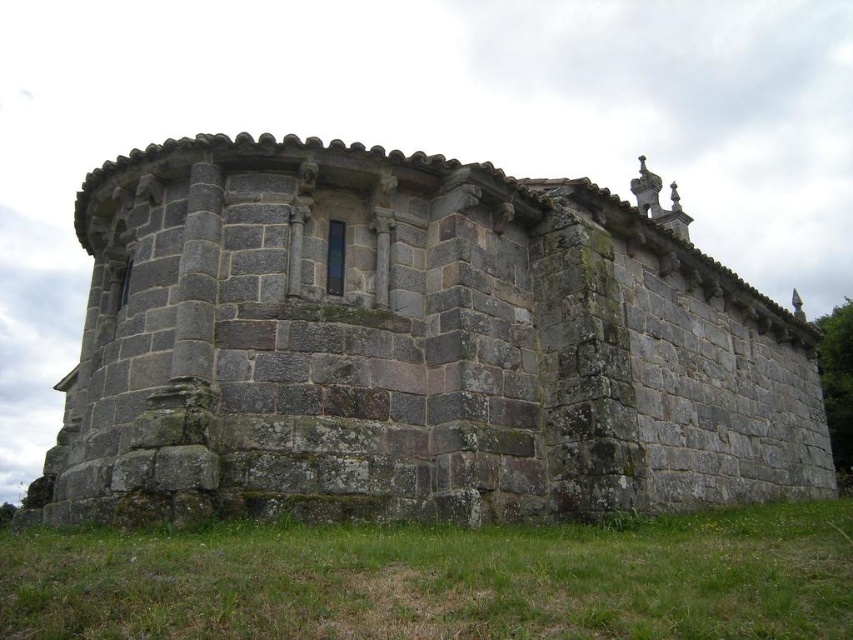
You are standing in front of a historic site and want to take a photo of the gray stone building at center. According to the coordinates provided, where exactly should you position your camera to capture the building at its central point?

The gray stone building at center is located at coordinates point (413, 348), so you should position your camera there to capture the building at its central point.

You are a construction worker assessing the site. You need to place a 10m long safety barrier between the gray stone building at center and the green grass at lower center. Given their relative sizes, will the barrier fit between them?

The gray stone building at center is wider than the green grass at lower center. Since the barrier is 10m long, it depends on the actual distance between them. However, the description only states the building is wider, not the distance between them. Without specific measurements of the space between, we cannot confirm if the barrier will fit.